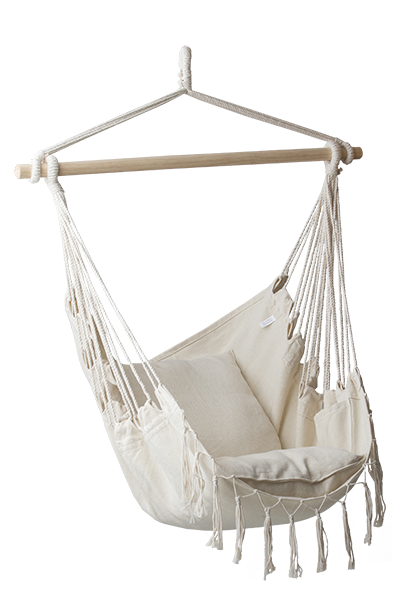
The image size is (400, 600). In order to click on tassels in this screenshot , I will do `click(216, 514)`, `click(241, 516)`, `click(269, 529)`, `click(296, 537)`, `click(324, 538)`, `click(345, 525)`, `click(372, 502)`, `click(378, 491)`.